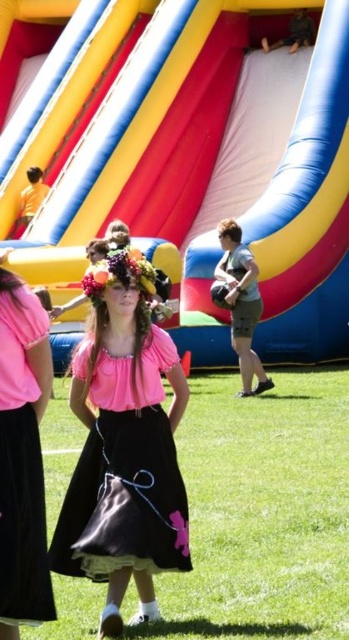
You are a photographer setting up a shot of the green grass at center and the pink satin dress at center. Which object will occupy more space in your photo?

The green grass at center will occupy more space in the photo because its width is larger than the pink satin dress at center.

You are standing at the fair and see two points marked in the image. Which point is closer to you, point (70, 525) or point (17, 556)?

Point (17, 556) is closer to you because it is closer to the camera than point (70, 525).

You are standing at the point with coordinates point (25, 496) and want to take a photo of the point (346, 125). Since you can only focus on one point at a time, which point should you focus on to ensure the other is in the background?

You should focus on point (346, 125) because it is closer to the camera than point (25, 496), making the latter the background.